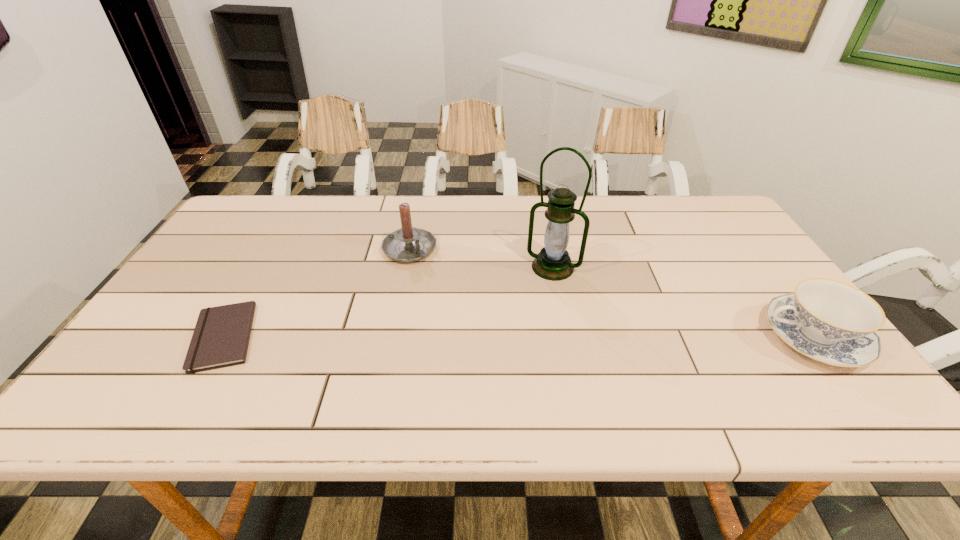
You are a GUI agent. You are given a task and a screenshot of the screen. Output one action in this format:
    pyautogui.click(x=<x>, y=<y>)
    Task: Click on the free spot on the desktop that is between the shortest object and the chinaware and is positioned on the side where the third object from left to right emits light
    The height and width of the screenshot is (540, 960).
    Given the screenshot: What is the action you would take?
    (x=518, y=337)

Locate an element on the screen. Image resolution: width=960 pixels, height=540 pixels. vacant space on the desktop that is between the checkbook and the third tallest object and is positioned on the side of the second object from left to right with the handle loop is located at coordinates (525, 337).